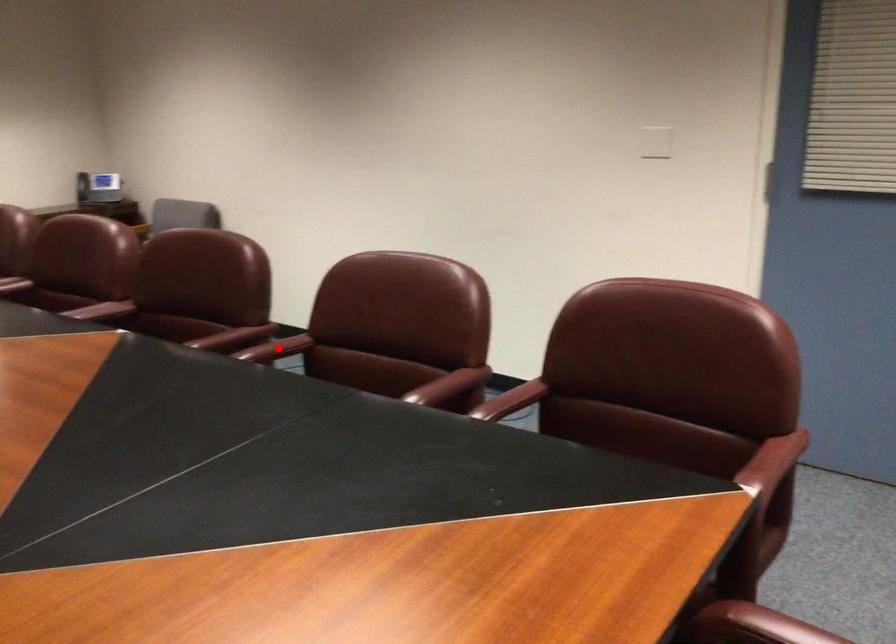
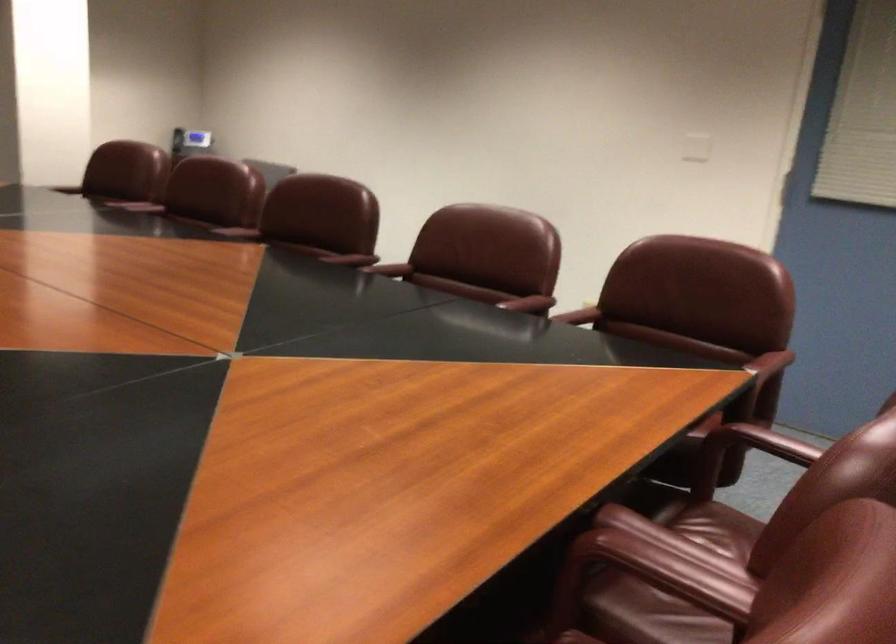
Question: I am providing you with two images of the same scene from different viewpoints. Image1 has a red point marked. In image2, the corresponding 3D location appears at what relative position? Reply with the corresponding letter.

Choices:
 (A) Closer
 (B) Farther

Answer: (B)